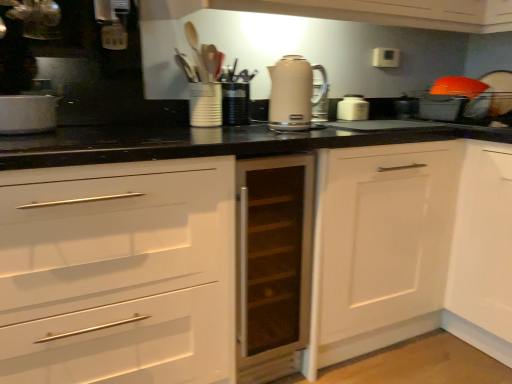
Question: Which direction should I rotate to look at white glossy toaster at center, the first kitchen appliance positioned from the back, — up or down?

Choices:
 (A) up
 (B) down

Answer: (A)

Question: From a real-world perspective, is beige glossy electric kettle at center, placed as the 2th kitchen appliance when sorted from front to back, under matte white container at center, which is counted as the 2th appliance, starting from the right?

Choices:
 (A) no
 (B) yes

Answer: (A)

Question: Could matte white container at center, which is counted as the 2th appliance, starting from the right, be considered to be inside beige glossy electric kettle at center, arranged as the second kitchen appliance when viewed from the left?

Choices:
 (A) yes
 (B) no

Answer: (B)

Question: From a real-world perspective, is beige glossy electric kettle at center, placed as the 2th kitchen appliance when sorted from front to back, on matte white container at center, which is counted as the 2th appliance, starting from the right?

Choices:
 (A) no
 (B) yes

Answer: (B)

Question: From the image's perspective, does beige glossy electric kettle at center, the second kitchen appliance from the right, appear lower than matte white container at center, which is counted as the 2th appliance, starting from the right?

Choices:
 (A) yes
 (B) no

Answer: (B)

Question: Does beige glossy electric kettle at center, the second kitchen appliance from the right, have a lesser width compared to matte white container at center, which is counted as the 2th appliance, starting from the right?

Choices:
 (A) yes
 (B) no

Answer: (A)

Question: Are beige glossy electric kettle at center, placed as the 2th kitchen appliance when sorted from front to back, and matte white container at center, acting as the 1th appliance starting from the left, beside each other?

Choices:
 (A) yes
 (B) no

Answer: (B)

Question: Is white glossy toaster at center, the first kitchen appliance positioned from the back, taller than satin silver wine cooler at center, the third kitchen appliance in the back-to-front sequence?

Choices:
 (A) yes
 (B) no

Answer: (A)

Question: Is white glossy toaster at center, which is the 3th kitchen appliance from left to right, looking in the opposite direction of satin silver wine cooler at center, the third kitchen appliance in the back-to-front sequence?

Choices:
 (A) no
 (B) yes

Answer: (A)

Question: From a real-world perspective, is white glossy toaster at center, which appears as the 1th kitchen appliance when viewed from the right, on satin silver wine cooler at center, the 1th kitchen appliance in the left-to-right sequence?

Choices:
 (A) yes
 (B) no

Answer: (B)

Question: Could you tell me if white glossy toaster at center, which appears as the 1th kitchen appliance when viewed from the right, is facing satin silver wine cooler at center, placed as the 3th kitchen appliance when sorted from right to left?

Choices:
 (A) no
 (B) yes

Answer: (A)

Question: From the image's perspective, would you say white glossy toaster at center, which is counted as the third kitchen appliance, starting from the front, is positioned over satin silver wine cooler at center, the 1th kitchen appliance in the left-to-right sequence?

Choices:
 (A) yes
 (B) no

Answer: (A)

Question: From a real-world perspective, is white glossy toaster at center, which is the 3th kitchen appliance from left to right, located beneath satin silver wine cooler at center, placed as the 1th kitchen appliance when sorted from front to back?

Choices:
 (A) no
 (B) yes

Answer: (B)

Question: Considering the relative positions of matte white container at center, acting as the 1th appliance starting from the left, and transparent glass cabinet at center, the 1th cabinetry positioned from the left, in the image provided, is matte white container at center, acting as the 1th appliance starting from the left, to the right of transparent glass cabinet at center, the 1th cabinetry positioned from the left, from the viewer's perspective?

Choices:
 (A) no
 (B) yes

Answer: (A)